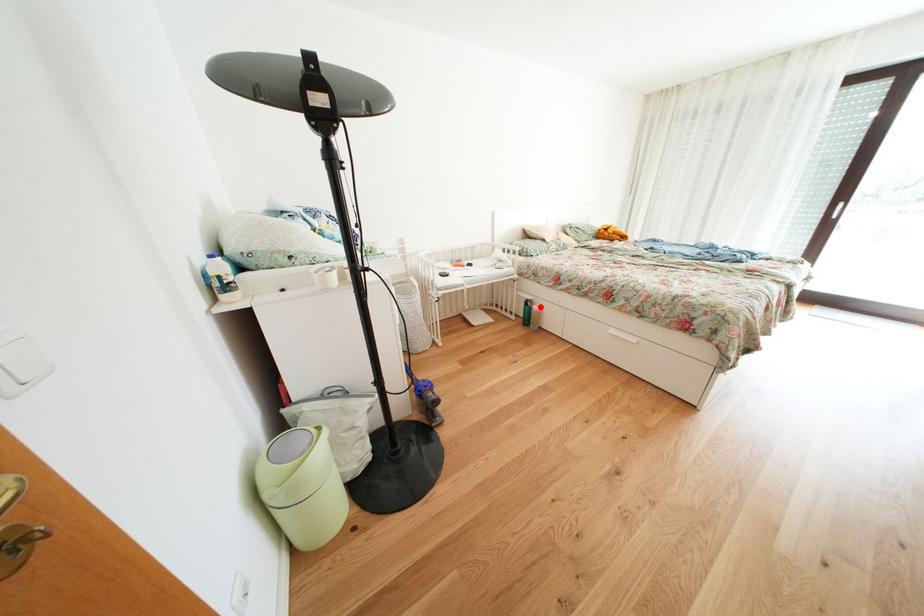
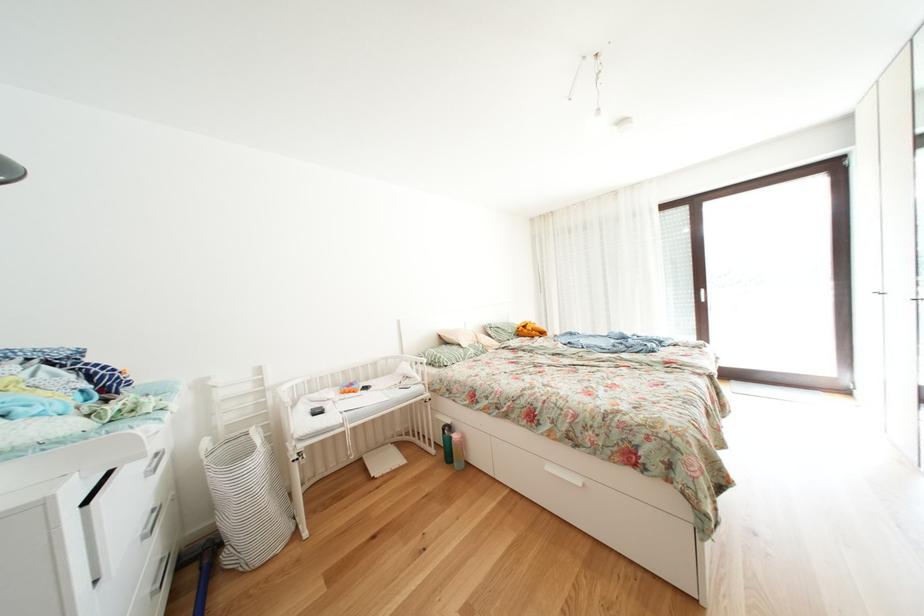
The point at the highlighted location is marked in the first image. Where is the corresponding point in the second image?

(458, 432)